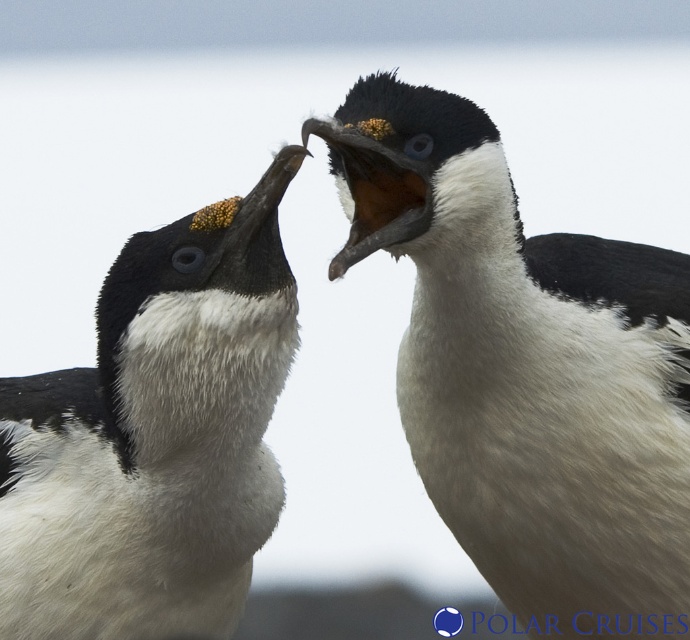
Question: Does white soft feathers at center have a greater width compared to white fluffy penguin at left?

Choices:
 (A) yes
 (B) no

Answer: (A)

Question: Is white soft feathers at center wider than white fluffy penguin at left?

Choices:
 (A) no
 (B) yes

Answer: (B)

Question: Does white soft feathers at center appear over white fluffy penguin at left?

Choices:
 (A) no
 (B) yes

Answer: (B)